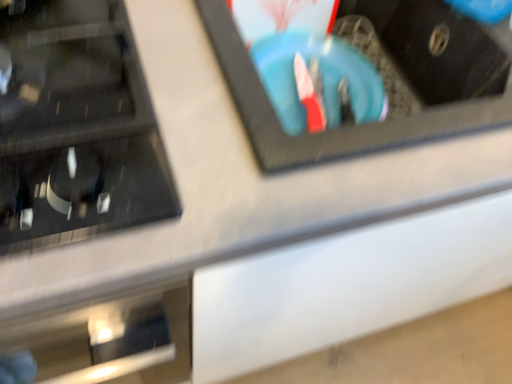
What do you see at coordinates (328, 131) in the screenshot? I see `blue plastic knife block at upper right` at bounding box center [328, 131].

Identify the location of blue plastic knife block at upper right. (328, 131).

Where is `blue plastic knife block at upper right`? Image resolution: width=512 pixels, height=384 pixels. blue plastic knife block at upper right is located at coordinates (328, 131).